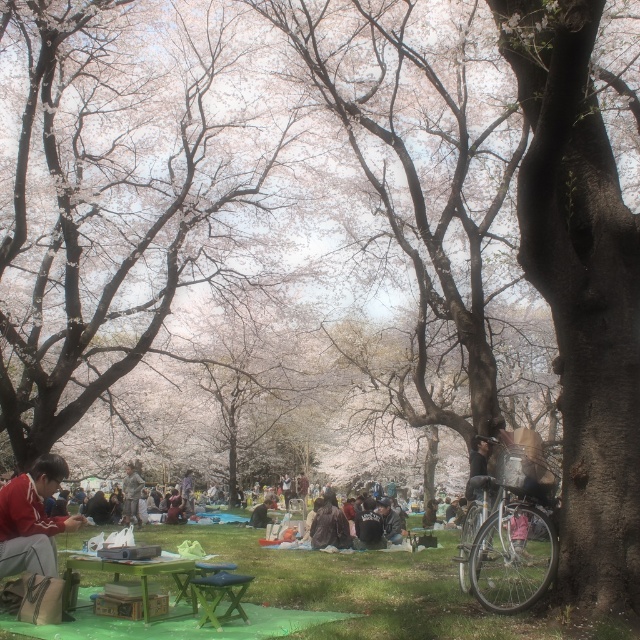
Which is more to the left, green wood park bench at center or wooden statue at center?

Positioned to the left is wooden statue at center.

Is point (232, 573) closer to viewer compared to point (132, 474)?

Yes.

You are a GUI agent. You are given a task and a screenshot of the screen. Output one action in this format:
    pyautogui.click(x=<x>, y=<y>)
    Task: Click on the green wood park bench at center
    The height and width of the screenshot is (640, 640).
    Given the screenshot: What is the action you would take?
    pyautogui.click(x=220, y=595)

Between red jacket at lower left and green wood park bench at center, which one appears on the left side from the viewer's perspective?

Positioned to the left is red jacket at lower left.

Which is more to the right, red jacket at lower left or green wood park bench at center?

green wood park bench at center is more to the right.

Which is in front, point (36, 481) or point (209, 620)?

Positioned in front is point (209, 620).

Find the location of a particular element. This screenshot has height=640, width=640. red jacket at lower left is located at coordinates (33, 518).

Locate an element on the screen. Image resolution: width=640 pixels, height=640 pixels. red jacket at lower left is located at coordinates (33, 518).

Which of these two, red jacket at lower left or green wood picnic table at lower center, stands taller?

With more height is red jacket at lower left.

You are a GUI agent. You are given a task and a screenshot of the screen. Output one action in this format:
    pyautogui.click(x=<x>, y=<y>)
    Task: Click on the red jacket at lower left
    The width and height of the screenshot is (640, 640).
    Given the screenshot: What is the action you would take?
    pyautogui.click(x=33, y=518)

At what (x,y) coordinates should I click in order to perform the action: click on red jacket at lower left. Please return your answer as a coordinate pair (x, y). The image size is (640, 640). Looking at the image, I should click on (33, 518).